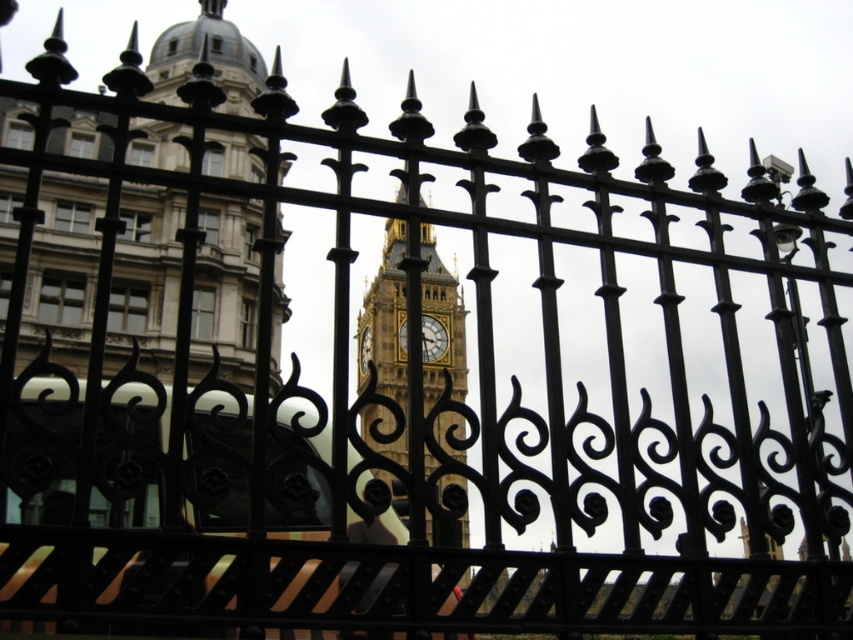
Is golden stone clock tower at center shorter than gold textured clock at center?

No, golden stone clock tower at center is not shorter than gold textured clock at center.

Between golden stone clock tower at center and gold textured clock at center, which one is positioned lower?

golden stone clock tower at center is lower down.

Does point (450, 371) come in front of point (422, 356)?

Yes, it is.

The height and width of the screenshot is (640, 853). I want to click on golden stone clock tower at center, so click(x=386, y=323).